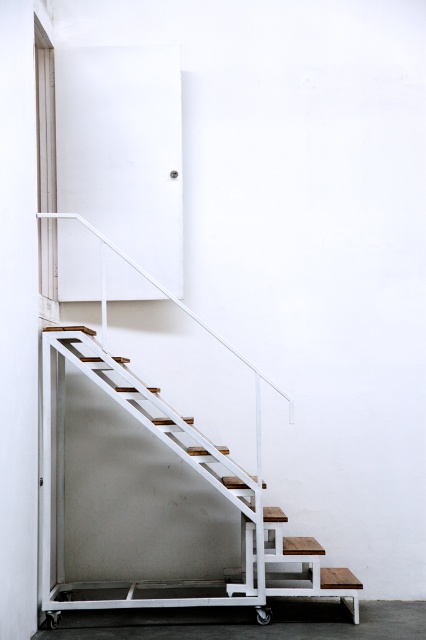
Question: Does wooden stairs at center appear over black rubber wheel at lower center?

Choices:
 (A) no
 (B) yes

Answer: (B)

Question: Is wooden stairs at center positioned behind black rubber wheel at lower center?

Choices:
 (A) yes
 (B) no

Answer: (B)

Question: Among these objects, which one is farthest from the camera?

Choices:
 (A) wooden stairs at center
 (B) black rubber wheel at lower center

Answer: (B)

Question: Does wooden stairs at center appear over black rubber wheel at lower center?

Choices:
 (A) no
 (B) yes

Answer: (B)

Question: Which object is closer to the camera taking this photo?

Choices:
 (A) black rubber wheel at lower center
 (B) wooden stairs at center

Answer: (B)